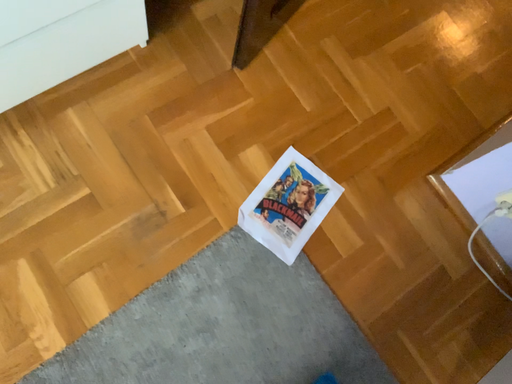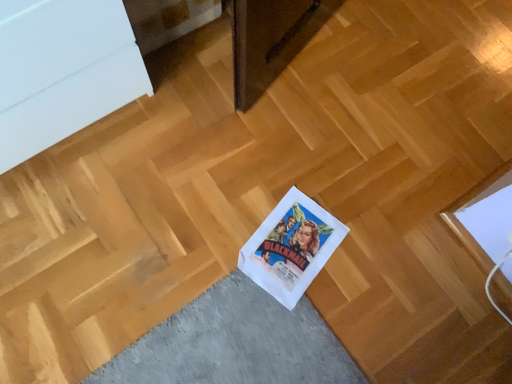
Question: How did the camera likely rotate when shooting the video?

Choices:
 (A) rotated right
 (B) rotated left

Answer: (B)